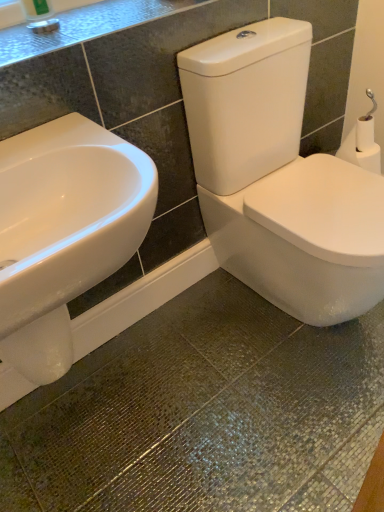
Describe the element at coordinates (86, 26) in the screenshot. I see `granite countertop at upper left` at that location.

Find the location of a particular element. white glossy sink at left is located at coordinates (64, 232).

Image resolution: width=384 pixels, height=512 pixels. What do you see at coordinates (362, 146) in the screenshot?
I see `white matte toilet paper at right` at bounding box center [362, 146].

At what (x,y) coordinates should I click in order to perform the action: click on granite countertop at upper left. Please return your answer as a coordinate pair (x, y). The width and height of the screenshot is (384, 512). Looking at the image, I should click on (86, 26).

From the image's perspective, is granite countertop at upper left located above or below white matte toilet paper at right?

granite countertop at upper left is above white matte toilet paper at right.

From their relative heights in the image, would you say granite countertop at upper left is taller or shorter than white matte toilet paper at right?

granite countertop at upper left is shorter than white matte toilet paper at right.

Would you say white matte toilet paper at right is part of granite countertop at upper left's contents?

No, white matte toilet paper at right is not inside granite countertop at upper left.

Which object is positioned more to the left, granite countertop at upper left or white matte toilet paper at right?

From the viewer's perspective, granite countertop at upper left appears more on the left side.

Does point (125, 17) appear closer or farther from the camera than point (5, 264)?

Point (125, 17) appears to be farther away from the viewer than point (5, 264).

Looking at this image, could you tell me if granite countertop at upper left is turned towards white glossy sink at left?

No, granite countertop at upper left is not oriented towards white glossy sink at left.

Identify the location of counter top on the right of the white glossy sink at left. The height and width of the screenshot is (512, 384). (86, 26).

From the image's perspective, between granite countertop at upper left and white glossy sink at left, who is located below?

From the image's view, white glossy sink at left is below.

From the image's perspective, is white matte toilet paper at right located beneath granite countertop at upper left?

Correct, white matte toilet paper at right appears lower than granite countertop at upper left in the image.

Does white matte toilet paper at right have a lesser height compared to granite countertop at upper left?

No, white matte toilet paper at right is not shorter than granite countertop at upper left.

Is point (347, 146) closer or farther from the camera than point (82, 30)?

Clearly, point (347, 146) is more distant from the camera than point (82, 30).

Could you tell me if white glossy sink at left is turned towards white matte toilet paper at right?

No, white glossy sink at left does not turn towards white matte toilet paper at right.

Which of these two, white glossy sink at left or white matte toilet paper at right, is bigger?

With larger size is white glossy sink at left.

Is white glossy sink at left to the left of white matte toilet paper at right from the viewer's perspective?

Correct, you'll find white glossy sink at left to the left of white matte toilet paper at right.

How far apart are white glossy sink at left and white matte toilet paper at right?

white glossy sink at left is 37.26 inches away from white matte toilet paper at right.

Which object is positioned more to the left, white matte toilet paper at right or white glossy sink at left?

white glossy sink at left.

Based on the photo, measure the distance between white matte toilet paper at right and white glossy sink at left.

A distance of 94.64 centimeters exists between white matte toilet paper at right and white glossy sink at left.

Considering the relative sizes of white matte toilet paper at right and white glossy sink at left in the image provided, is white matte toilet paper at right thinner than white glossy sink at left?

Correct, the width of white matte toilet paper at right is less than that of white glossy sink at left.

Where is `sink in front of the granite countertop at upper left`? sink in front of the granite countertop at upper left is located at coordinates (64, 232).

Can you confirm if white glossy sink at left is thinner than granite countertop at upper left?

No.

You are a GUI agent. You are given a task and a screenshot of the screen. Output one action in this format:
    pyautogui.click(x=<x>, y=<y>)
    Task: Click on the toilet paper on the right of granite countertop at upper left
    
    Given the screenshot: What is the action you would take?
    pyautogui.click(x=362, y=146)

The image size is (384, 512). Find the location of `sink in front of the granite countertop at upper left`. sink in front of the granite countertop at upper left is located at coordinates (64, 232).

Estimate the real-world distances between objects in this image. Which object is closer to white matte toilet paper at right, white glossy sink at left or granite countertop at upper left?

granite countertop at upper left is closer to white matte toilet paper at right.

From the image, which object appears to be nearer to white matte toilet paper at right, granite countertop at upper left or white glossy sink at left?

granite countertop at upper left.

Looking at this image, which object lies further to the anchor point granite countertop at upper left, white matte toilet paper at right or white glossy sink at left?

Among the two, white matte toilet paper at right is located further to granite countertop at upper left.

From the image, which object appears to be nearer to white glossy sink at left, white matte toilet paper at right or granite countertop at upper left?

granite countertop at upper left lies closer to white glossy sink at left than the other object.

Estimate the real-world distances between objects in this image. Which object is closer to white glossy sink at left, granite countertop at upper left or white matte toilet paper at right?

Among the two, granite countertop at upper left is located nearer to white glossy sink at left.

From the image, which object appears to be farther from granite countertop at upper left, white glossy sink at left or white matte toilet paper at right?

white matte toilet paper at right lies further to granite countertop at upper left than the other object.

Locate an element on the screen. counter top between white glossy sink at left and white matte toilet paper at right from left to right is located at coordinates (86, 26).